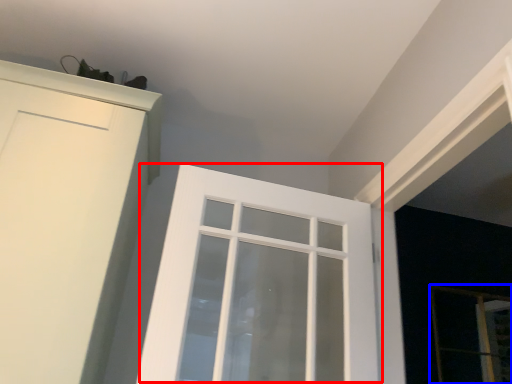
Question: Which object is further to the camera taking this photo, window (highlighted by a red box) or screen door (highlighted by a blue box)?

Choices:
 (A) window
 (B) screen door

Answer: (B)